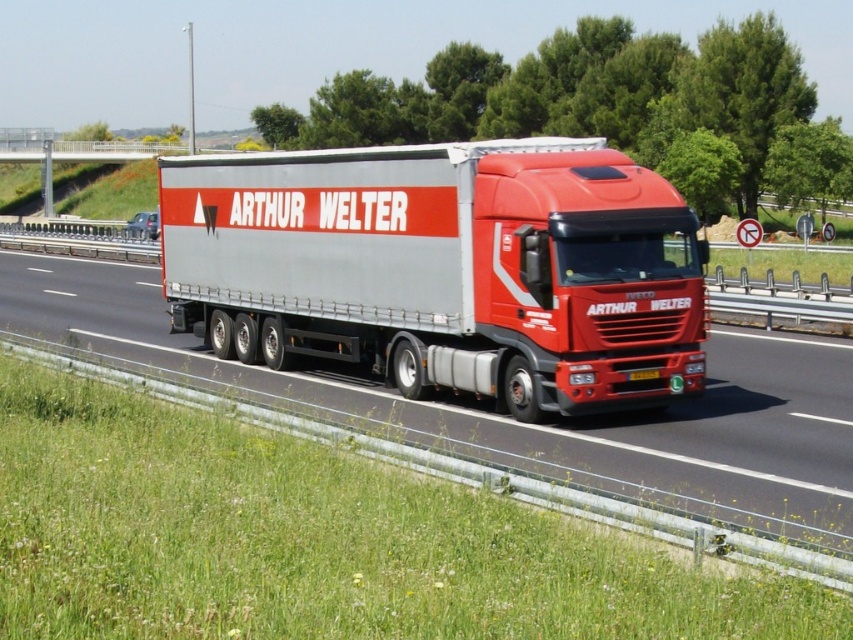
You are a traffic officer observing a highway. You see a metallic silver trailer truck at center and a red matte truck at center. Which one is positioned more to the right side of the highway?

The metallic silver trailer truck at center is positioned more to the right side of the highway than the red matte truck at center.

Looking at this image, you are a driver approaching a highway with a large red and silver semi truck in front of you. You need to determine if there is any object at the point marked as [445,268]. What is located at that point?

The point [445,268] is occupied by the metallic silver trailer truck at center.